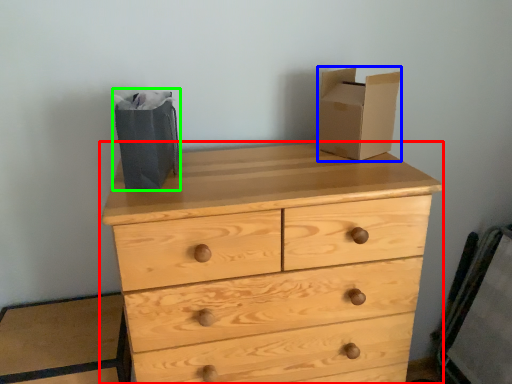
Question: Which object is positioned closest to chest of drawers (highlighted by a red box)? Select from cardboard box (highlighted by a blue box) and shopping bag (highlighted by a green box).

Choices:
 (A) cardboard box
 (B) shopping bag

Answer: (A)